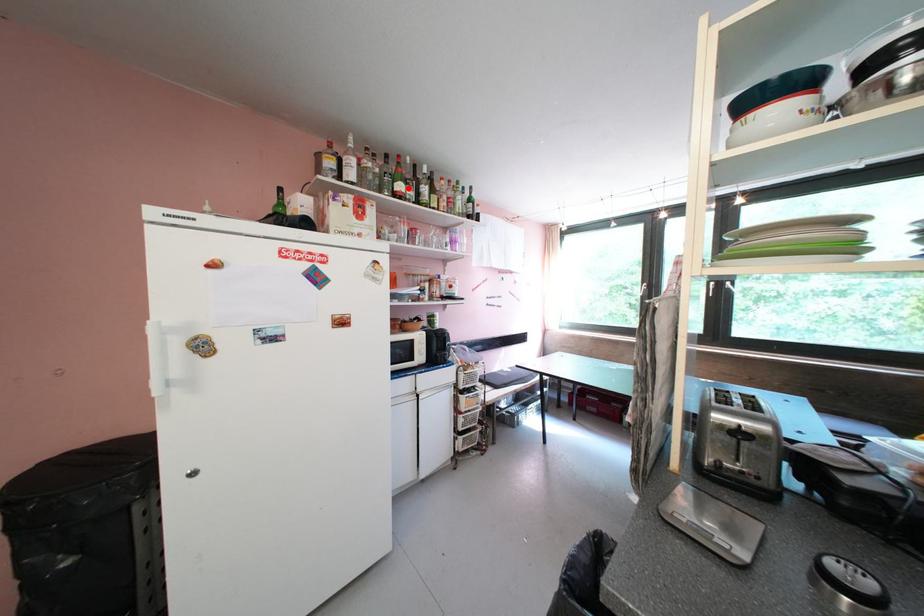
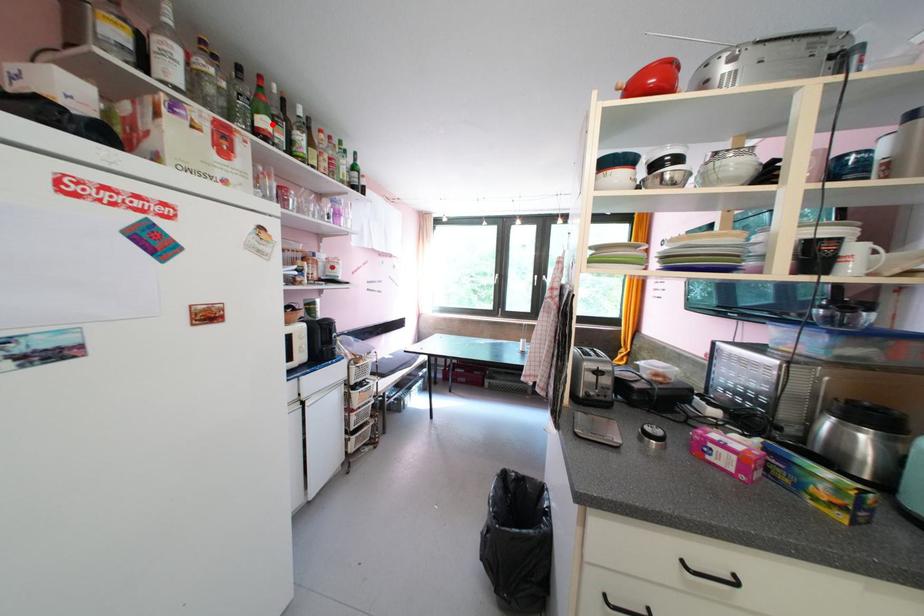
I am providing you with two images of the same scene from different viewpoints. A red point is marked on the first image and another point is marked on the second image. Does the point marked in image1 correspond to the same location as the one in image2?

Yes